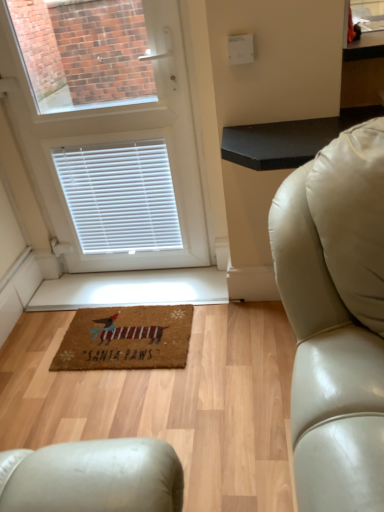
Describe the element at coordinates (103, 132) in the screenshot. I see `white matte door at upper left` at that location.

What is the approximate width of white matte door at upper left?

white matte door at upper left is 4.87 inches wide.

Find the location of a particular element. white matte door at upper left is located at coordinates (103, 132).

I want to click on white matte door at upper left, so click(x=103, y=132).